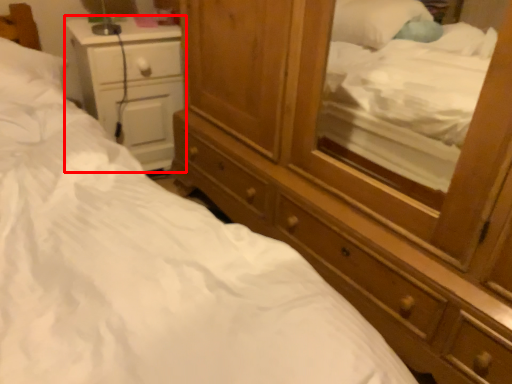
Question: From the image's perspective, what is the correct spatial relationship of nightstand (annotated by the red box) in relation to dresser?

Choices:
 (A) below
 (B) above

Answer: (B)